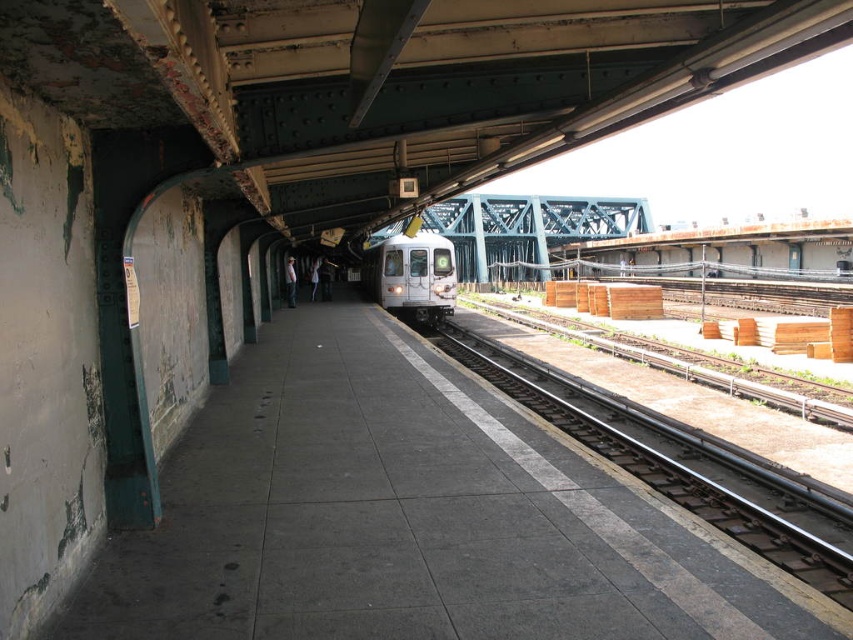
Who is higher up, metal/smooth train track at right or silver metallic train at center?

silver metallic train at center is higher up.

Which is in front, point (467, 362) or point (396, 284)?

Point (467, 362) is more forward.

Where is `metal/smooth train track at right`? The width and height of the screenshot is (853, 640). metal/smooth train track at right is located at coordinates (659, 467).